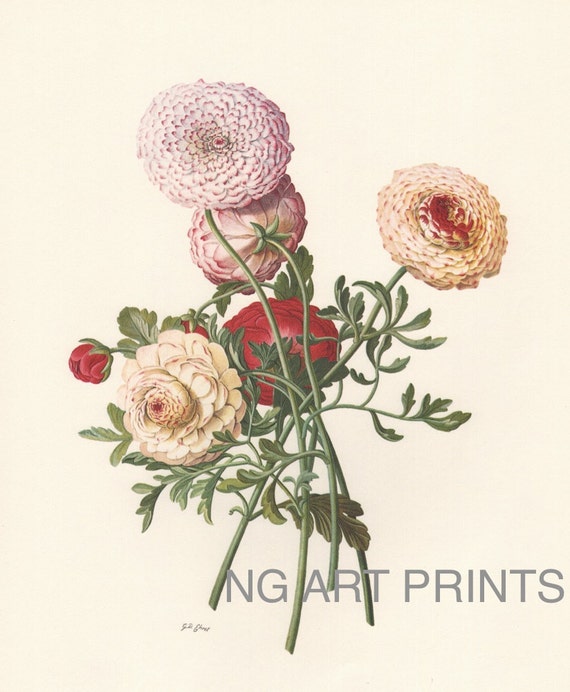
Image resolution: width=570 pixels, height=692 pixels. I want to click on art, so click(x=345, y=589).